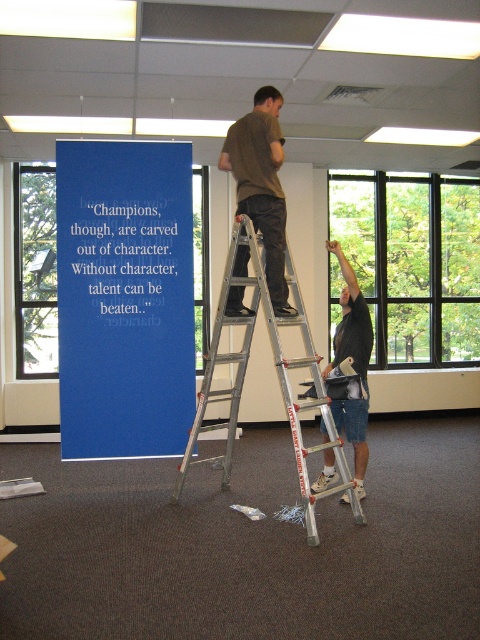
Does blue matte sign at center lie behind silver metallic ladder at center?

Yes, it is.

Does blue matte sign at center have a lesser height compared to silver metallic ladder at center?

In fact, blue matte sign at center may be taller than silver metallic ladder at center.

Is point (99, 332) farther from camera compared to point (230, 256)?

That is True.

Where is `blue matte sign at center`? This screenshot has height=640, width=480. blue matte sign at center is located at coordinates (124, 298).

Is point (112, 221) positioned behind point (269, 179)?

That is True.

Which is above, blue paper at center or brown cotton shirt at upper center?

brown cotton shirt at upper center

What do you see at coordinates (129, 260) in the screenshot? I see `blue paper at center` at bounding box center [129, 260].

Image resolution: width=480 pixels, height=640 pixels. What are the coordinates of `blue paper at center` in the screenshot? It's located at (129, 260).

Describe the element at coordinates (276, 369) in the screenshot. I see `silver metallic ladder at center` at that location.

Is silver metallic ladder at center shorter than brown cotton shirt at upper center?

In fact, silver metallic ladder at center may be taller than brown cotton shirt at upper center.

Locate an element on the screen. The width and height of the screenshot is (480, 640). silver metallic ladder at center is located at coordinates (276, 369).